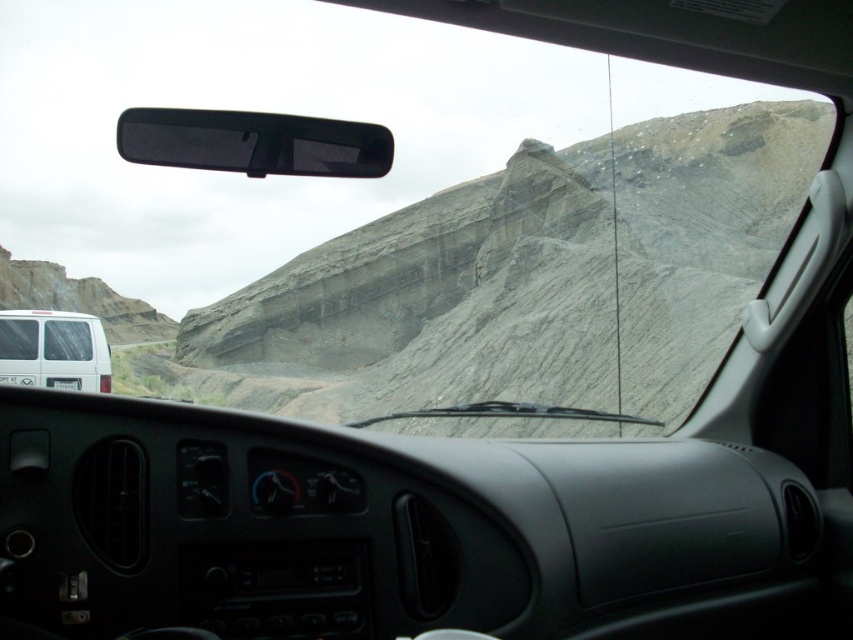
Consider the image. You are driving a car and want to overtake the white matte van at left. The minimum safe distance required to overtake is 100 meters. Can you safely overtake the van based on the current distance?

The distance between the white matte van at left and the camera is 112.74 meters, which exceeds the minimum safe distance of 100 meters. Therefore, you can safely overtake the van.